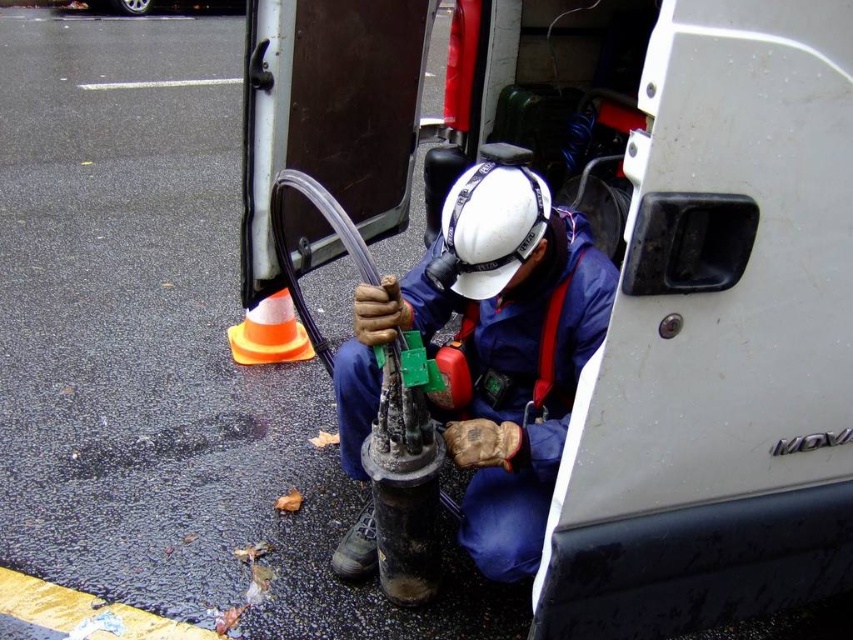
Is blue fabric construction worker at center further to camera compared to orange reflective plastic traffic cone at lower center?

No, it is in front of orange reflective plastic traffic cone at lower center.

Is blue fabric construction worker at center below orange reflective plastic traffic cone at lower center?

Correct, blue fabric construction worker at center is located below orange reflective plastic traffic cone at lower center.

Does point (492, 449) come closer to viewer compared to point (285, 310)?

Yes, it is in front of point (285, 310).

The image size is (853, 640). In order to click on blue fabric construction worker at center in this screenshot , I will do `click(491, 349)`.